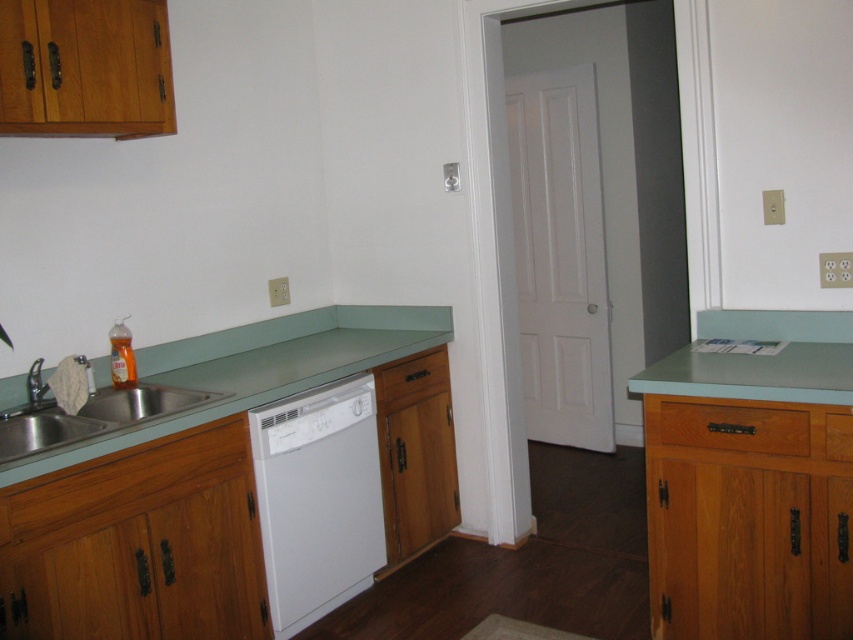
Question: Does green matte countertop at lower left come behind brushed metal faucet at sink left?

Choices:
 (A) yes
 (B) no

Answer: (B)

Question: Can you confirm if white matte dishwasher at center is positioned to the right of stainless steel sink at lower left?

Choices:
 (A) no
 (B) yes

Answer: (B)

Question: Is white matte dishwasher at center bigger than stainless steel sink at lower left?

Choices:
 (A) yes
 (B) no

Answer: (A)

Question: Which is farther from the brushed metal faucet at sink left?

Choices:
 (A) stainless steel sink at lower left
 (B) white matte dishwasher at center

Answer: (B)

Question: Which object is farther from the camera taking this photo?

Choices:
 (A) stainless steel sink at lower left
 (B) brushed metal faucet at sink left

Answer: (B)

Question: Considering the real-world distances, which object is closest to the green matte countertop at lower left?

Choices:
 (A) stainless steel sink at lower left
 (B) brushed metal faucet at sink left

Answer: (A)